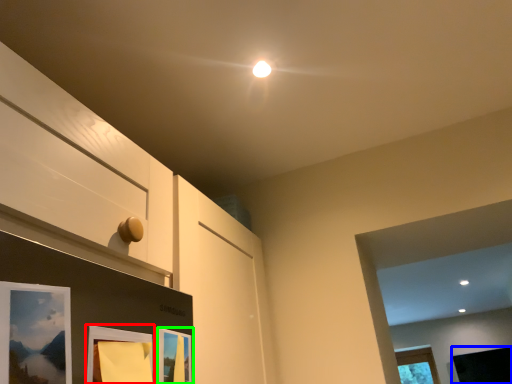
Question: Considering the real-world distances, which object is closest to picture frame (highlighted by a red box)? picture frame (highlighted by a blue box) or picture frame (highlighted by a green box).

Choices:
 (A) picture frame
 (B) picture frame

Answer: (B)